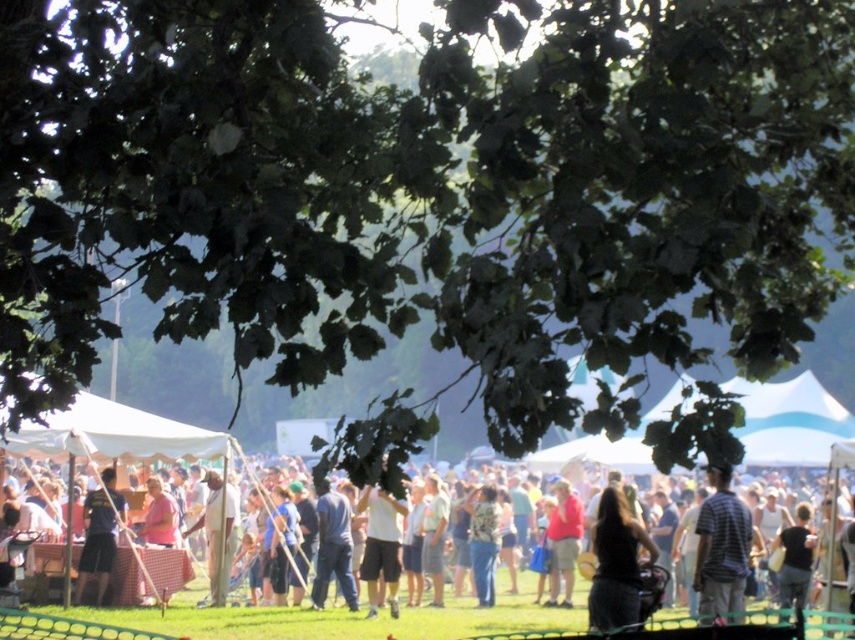
Question: Is dark blue jeans at center closer to the viewer compared to striped cotton shirt at center-right?

Choices:
 (A) yes
 (B) no

Answer: (B)

Question: Can you confirm if dark blue jeans at center is positioned below striped cotton shirt at center-right?

Choices:
 (A) yes
 (B) no

Answer: (A)

Question: Which object is the farthest from the red shirt at center?

Choices:
 (A) dark blue shirt at lower left
 (B) striped cotton shirt at center-right
 (C) white matte shirt at center

Answer: (B)

Question: Among these points, which one is farthest from the camera?

Choices:
 (A) (575, 509)
 (B) (37, 429)
 (C) (709, 512)
 (D) (606, 589)

Answer: (A)

Question: Can you confirm if white fabric tent at center is wider than dark brown hair at center?

Choices:
 (A) no
 (B) yes

Answer: (B)

Question: Which object is the farthest from the white matte shirt at center?

Choices:
 (A) dark blue shirt at lower left
 (B) red shirt at center
 (C) white fabric canopy at center
 (D) white fabric tent at center

Answer: (C)